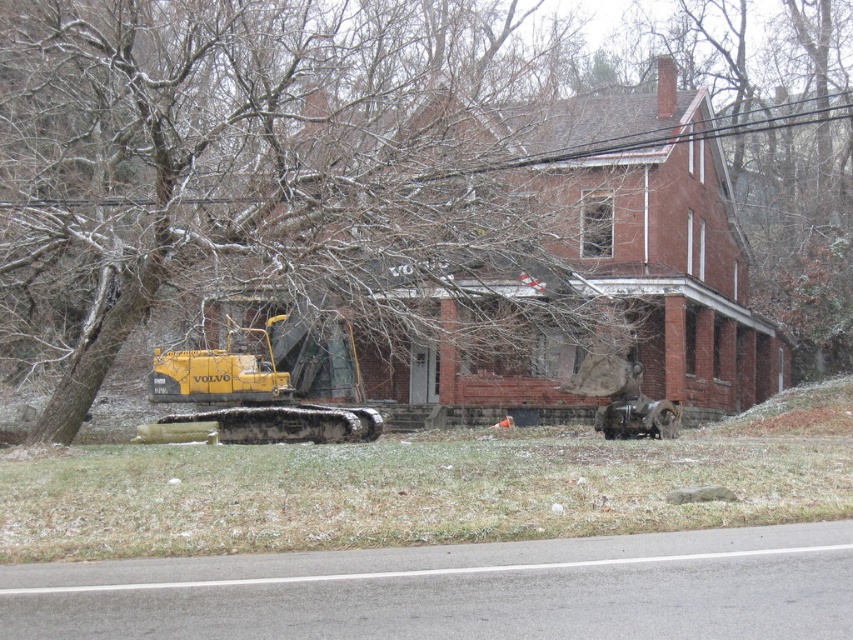
Looking at this image, who is more distant from viewer, (x=460, y=90) or (x=248, y=438)?

The point (x=460, y=90) is more distant.

Describe the element at coordinates (242, 160) in the screenshot. I see `snow-covered branches at upper left` at that location.

Locate an element on the screen. This screenshot has width=853, height=640. snow-covered branches at upper left is located at coordinates (242, 160).